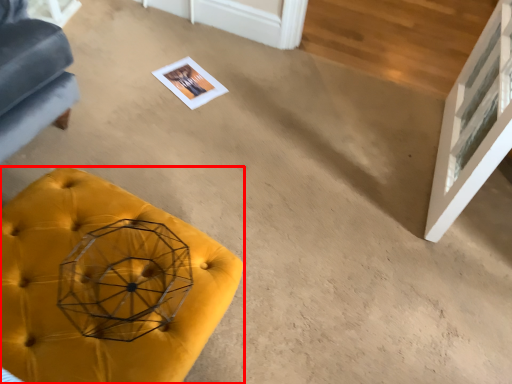
Question: Observing the image, what is the correct spatial positioning of furniture (annotated by the red box) in reference to glass door?

Choices:
 (A) left
 (B) right

Answer: (A)